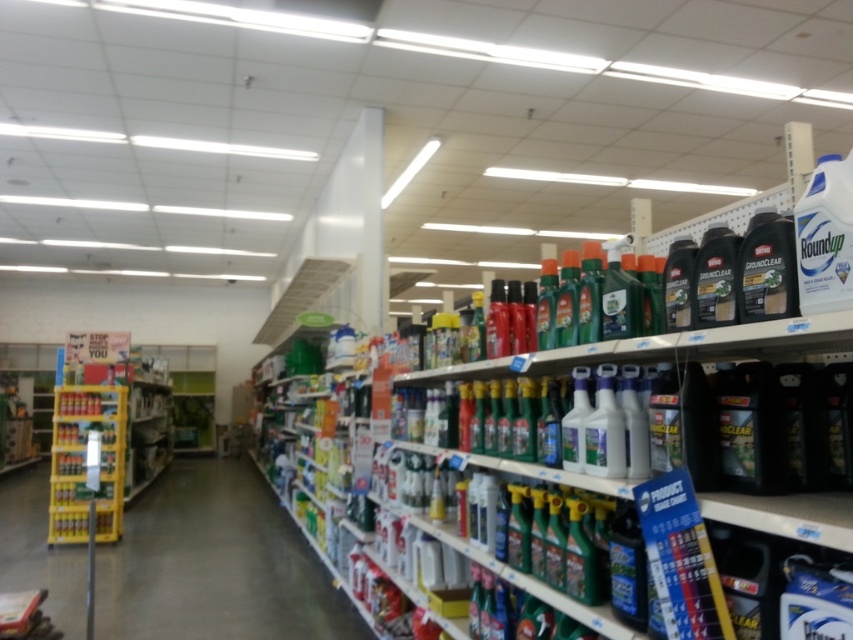
Question: Is green plastic bottles at center wider than yellow plastic shelf at left?

Choices:
 (A) no
 (B) yes

Answer: (B)

Question: Is green plastic bottles at center bigger than yellow plastic shelf at left?

Choices:
 (A) yes
 (B) no

Answer: (A)

Question: Which point appears closest to the camera in this image?

Choices:
 (A) (74, 452)
 (B) (18, 586)

Answer: (B)

Question: Which point is closer to the camera taking this photo?

Choices:
 (A) (51, 504)
 (B) (224, 556)

Answer: (B)

Question: Which point is farther from the camera taking this photo?

Choices:
 (A) (119, 449)
 (B) (221, 614)

Answer: (A)

Question: Is green plastic bottles at center positioned at the back of yellow plastic shelf at left?

Choices:
 (A) yes
 (B) no

Answer: (B)